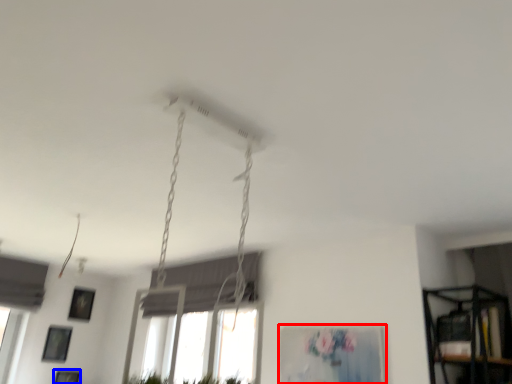
Question: Which point is closer to the camera, picture frame (highlighted by a red box) or picture frame (highlighted by a blue box)?

Choices:
 (A) picture frame
 (B) picture frame

Answer: (A)